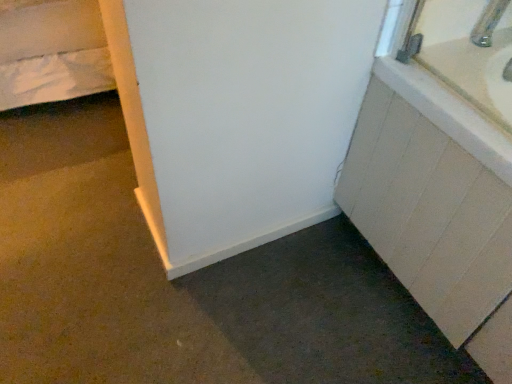
Question: From the image's perspective, is metallic silver faucet at upper right located beneath white matte cabinet at right?

Choices:
 (A) yes
 (B) no

Answer: (B)

Question: Is metallic silver faucet at upper right thinner than white matte cabinet at right?

Choices:
 (A) yes
 (B) no

Answer: (A)

Question: Considering the relative positions of metallic silver faucet at upper right and white matte cabinet at right in the image provided, is metallic silver faucet at upper right to the right of white matte cabinet at right from the viewer's perspective?

Choices:
 (A) no
 (B) yes

Answer: (A)

Question: Considering the relative sizes of metallic silver faucet at upper right and white matte cabinet at right in the image provided, is metallic silver faucet at upper right wider than white matte cabinet at right?

Choices:
 (A) yes
 (B) no

Answer: (B)

Question: Are metallic silver faucet at upper right and white matte cabinet at right far apart?

Choices:
 (A) yes
 (B) no

Answer: (B)

Question: Is metallic silver faucet at upper right outside of white matte cabinet at right?

Choices:
 (A) no
 (B) yes

Answer: (B)

Question: Can you confirm if white matte cabinet at right is thinner than metallic silver faucet at upper right?

Choices:
 (A) yes
 (B) no

Answer: (B)

Question: From the image's perspective, is white matte cabinet at right located above metallic silver faucet at upper right?

Choices:
 (A) yes
 (B) no

Answer: (B)

Question: Considering the relative positions of white matte cabinet at right and metallic silver faucet at upper right in the image provided, is white matte cabinet at right to the right of metallic silver faucet at upper right from the viewer's perspective?

Choices:
 (A) no
 (B) yes

Answer: (B)

Question: Does white matte cabinet at right have a smaller size compared to metallic silver faucet at upper right?

Choices:
 (A) no
 (B) yes

Answer: (A)

Question: Does white matte cabinet at right come behind metallic silver faucet at upper right?

Choices:
 (A) no
 (B) yes

Answer: (A)

Question: Does white matte cabinet at right have a larger size compared to metallic silver faucet at upper right?

Choices:
 (A) no
 (B) yes

Answer: (B)

Question: From the image's perspective, is metallic silver faucet at upper right positioned above or below white matte cabinet at right?

Choices:
 (A) below
 (B) above

Answer: (B)